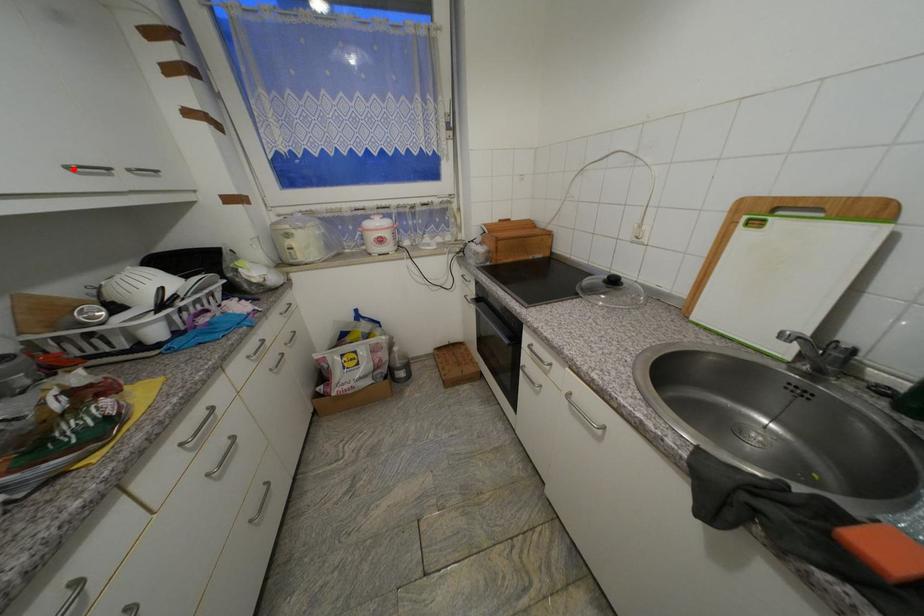
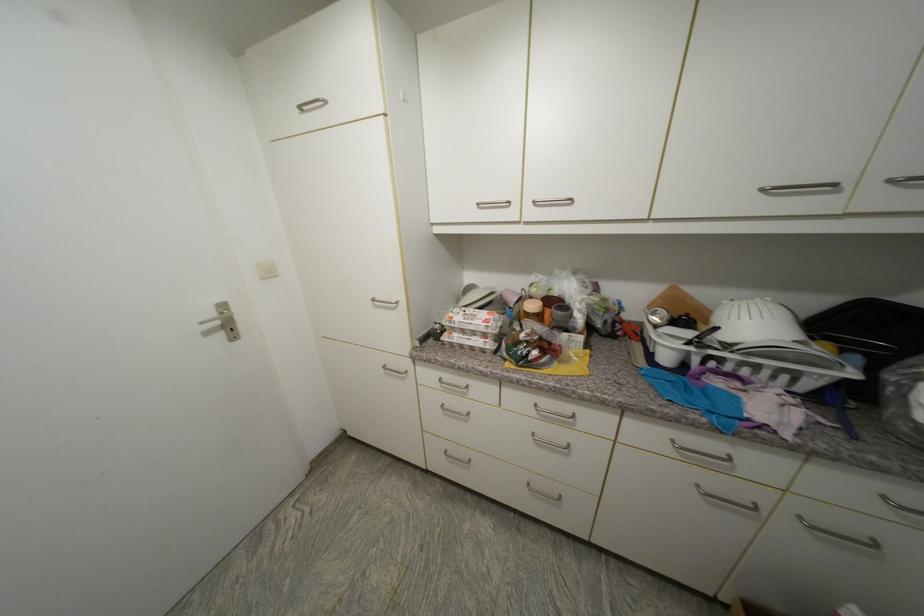
The point at the highlighted location is marked in the first image. Where is the corresponding point in the second image?

(768, 191)